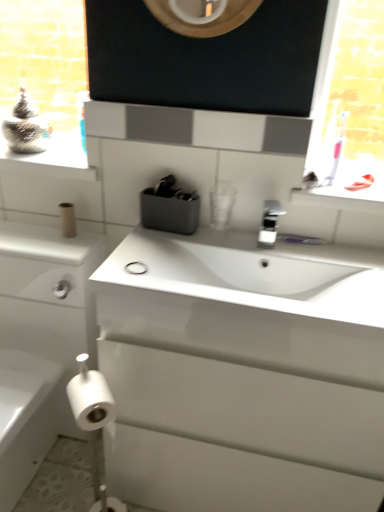
The width and height of the screenshot is (384, 512). Identify the location of vacant point to the right of silver metallic faucet at center. (314, 255).